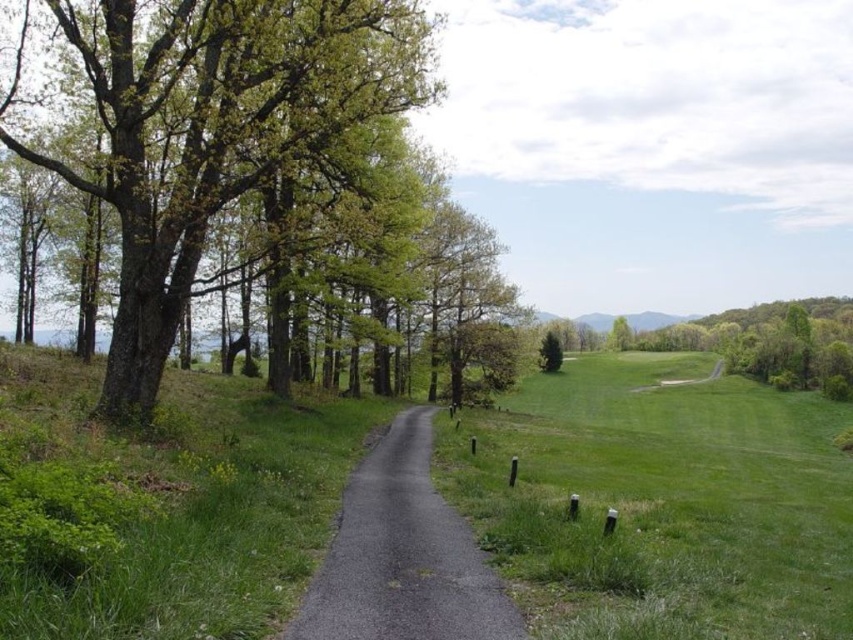
Does point (448, 538) come in front of point (624, 317)?

Yes, it is in front of point (624, 317).

Does asphalt road at center appear on the right side of green leafy tree at center-right?

In fact, asphalt road at center is to the left of green leafy tree at center-right.

Does point (375, 579) come in front of point (624, 348)?

Yes, it is in front of point (624, 348).

Find the location of a particular element. This screenshot has height=640, width=853. asphalt road at center is located at coordinates (402, 556).

Does green leafy tree at left appear under green leafy tree at center-right?

No.

Is point (167, 112) farther from camera compared to point (624, 348)?

That is False.

Where is `green leafy tree at left`? The height and width of the screenshot is (640, 853). green leafy tree at left is located at coordinates (263, 163).

Describe the element at coordinates (263, 163) in the screenshot. This screenshot has height=640, width=853. I see `green leafy tree at left` at that location.

Find the location of a particular element. green leafy tree at left is located at coordinates (263, 163).